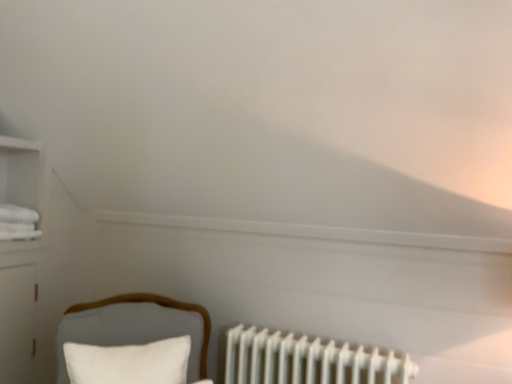
Question: Considering the relative sizes of white matte radiator at lower right and velvet white chair at lower left in the image provided, is white matte radiator at lower right shorter than velvet white chair at lower left?

Choices:
 (A) no
 (B) yes

Answer: (B)

Question: Does white matte radiator at lower right come behind velvet white chair at lower left?

Choices:
 (A) no
 (B) yes

Answer: (B)

Question: Is velvet white chair at lower left inside white matte radiator at lower right?

Choices:
 (A) yes
 (B) no

Answer: (B)

Question: From a real-world perspective, is white matte radiator at lower right below velvet white chair at lower left?

Choices:
 (A) yes
 (B) no

Answer: (A)

Question: From the image's perspective, is white matte radiator at lower right located beneath velvet white chair at lower left?

Choices:
 (A) no
 (B) yes

Answer: (B)

Question: Is white matte radiator at lower right at the right side of velvet white chair at lower left?

Choices:
 (A) yes
 (B) no

Answer: (A)

Question: Is velvet white chair at lower left oriented away from white soft pillow at lower left?

Choices:
 (A) no
 (B) yes

Answer: (B)

Question: Considering the relative sizes of velvet white chair at lower left and white soft pillow at lower left in the image provided, is velvet white chair at lower left wider than white soft pillow at lower left?

Choices:
 (A) no
 (B) yes

Answer: (B)

Question: Can you confirm if velvet white chair at lower left is shorter than white soft pillow at lower left?

Choices:
 (A) yes
 (B) no

Answer: (B)

Question: Is velvet white chair at lower left not inside white soft pillow at lower left?

Choices:
 (A) no
 (B) yes

Answer: (B)

Question: From a real-world perspective, is velvet white chair at lower left over white soft pillow at lower left?

Choices:
 (A) no
 (B) yes

Answer: (A)

Question: Can you confirm if velvet white chair at lower left is thinner than white soft pillow at lower left?

Choices:
 (A) no
 (B) yes

Answer: (A)

Question: Does white matte radiator at lower right lie in front of white soft pillow at lower left?

Choices:
 (A) no
 (B) yes

Answer: (A)